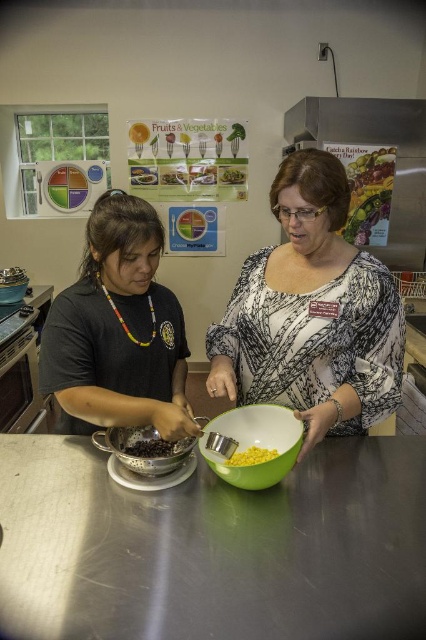
You are a chef preparing a dish and need to place a large cutting board on the stainless steel counter at center. Considering the size of the counter compared to the black matte shirt at left, will the cutting board fit?

The stainless steel counter at center is smaller than the black matte shirt at left. Since the counter is smaller, it might not have enough space to accommodate a large cutting board unless the shirt is moved.

You are a chef preparing a dish and need to know which item is bigger between the black matte shirt at left and the black matte beans at center. Which one should you choose if you need a larger item?

The black matte shirt at left has a larger size compared to the black matte beans at center, so you should choose the black matte shirt at left.